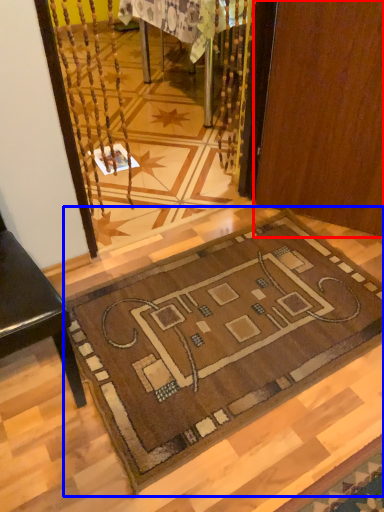
Question: Which of the following is the farthest to the observer, door (highlighted by a red box) or mat (highlighted by a blue box)?

Choices:
 (A) door
 (B) mat

Answer: (A)